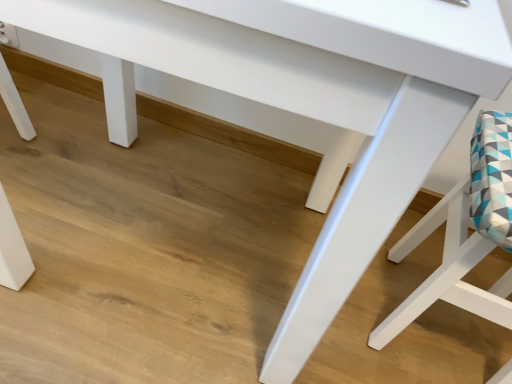
Question: Should I look upward or downward to see white glossy chair at lower right?

Choices:
 (A) up
 (B) down

Answer: (B)